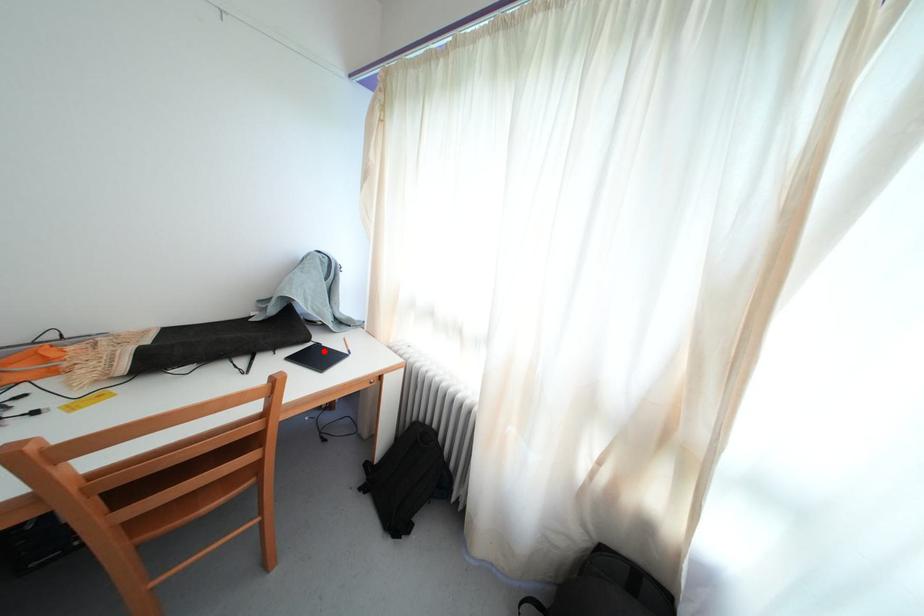
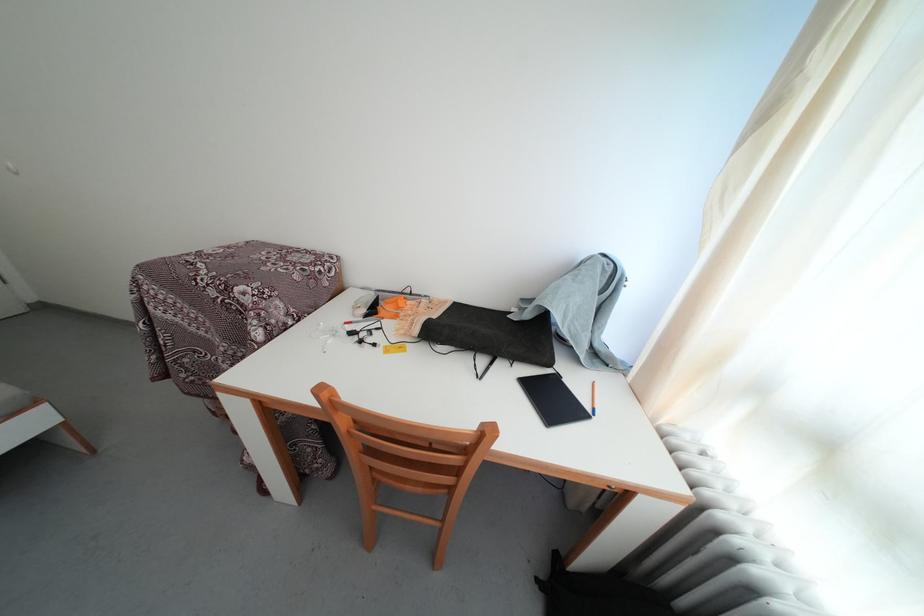
In the second image, find the point that corresponds to the highlighted location in the first image.

(564, 383)